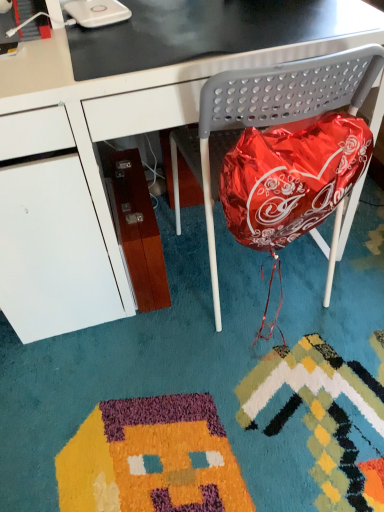
Question: Does metallic gray folding chair at center lie behind black glossy table at upper center?

Choices:
 (A) yes
 (B) no

Answer: (B)

Question: Considering the relative positions of metallic gray folding chair at center and black glossy table at upper center in the image provided, is metallic gray folding chair at center to the left of black glossy table at upper center from the viewer's perspective?

Choices:
 (A) yes
 (B) no

Answer: (B)

Question: Is black glossy table at upper center at the back of metallic gray folding chair at center?

Choices:
 (A) no
 (B) yes

Answer: (A)

Question: Can we say metallic gray folding chair at center lies outside black glossy table at upper center?

Choices:
 (A) yes
 (B) no

Answer: (A)

Question: Would you say black glossy table at upper center is part of metallic gray folding chair at center's contents?

Choices:
 (A) yes
 (B) no

Answer: (A)

Question: Is metallic gray folding chair at center to the right of black glossy table at upper center from the viewer's perspective?

Choices:
 (A) no
 (B) yes

Answer: (B)

Question: Is black glossy desk at center thinner than metallic gray folding chair at center?

Choices:
 (A) no
 (B) yes

Answer: (A)

Question: Is black glossy desk at center far away from metallic gray folding chair at center?

Choices:
 (A) yes
 (B) no

Answer: (B)

Question: From the image's perspective, is black glossy desk at center above metallic gray folding chair at center?

Choices:
 (A) yes
 (B) no

Answer: (A)

Question: Does black glossy desk at center contain metallic gray folding chair at center?

Choices:
 (A) no
 (B) yes

Answer: (B)

Question: Is black glossy desk at center located outside metallic gray folding chair at center?

Choices:
 (A) yes
 (B) no

Answer: (A)

Question: Is black glossy desk at center wider than metallic gray folding chair at center?

Choices:
 (A) yes
 (B) no

Answer: (A)

Question: From the image's perspective, does black glossy table at upper center appear higher than metallic gray folding chair at center?

Choices:
 (A) no
 (B) yes

Answer: (B)